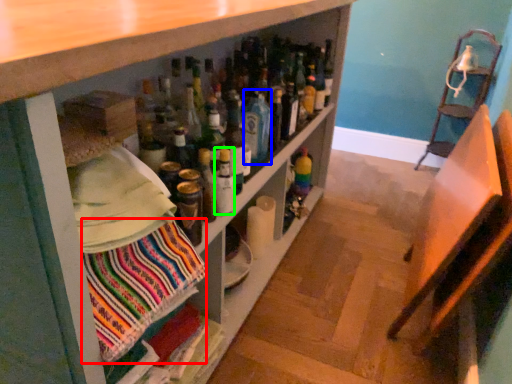
Question: Estimate the real-world distances between objects in this image. Which object is farther from fabric (highlighted by a red box), beverage (highlighted by a blue box) or bottle (highlighted by a green box)?

Choices:
 (A) beverage
 (B) bottle

Answer: (A)